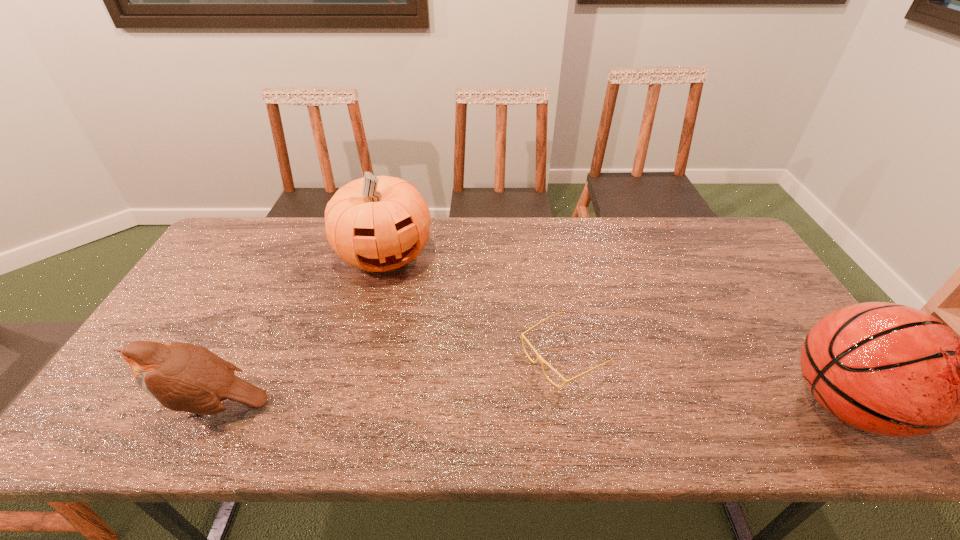
Where is `the leftmost object`? This screenshot has height=540, width=960. the leftmost object is located at coordinates (185, 377).

The height and width of the screenshot is (540, 960). Find the location of `bird`. bird is located at coordinates (185, 377).

This screenshot has height=540, width=960. Identify the location of basketball. (888, 369).

The height and width of the screenshot is (540, 960). In order to click on the shortest object in this screenshot , I will do `click(539, 357)`.

Locate an element on the screen. This screenshot has height=540, width=960. the second object from right to left is located at coordinates [x=539, y=357].

At what (x,y) coordinates should I click in order to perform the action: click on the third object from right to left. Please return your answer as a coordinate pair (x, y). Image resolution: width=960 pixels, height=540 pixels. Looking at the image, I should click on (377, 223).

You are a GUI agent. You are given a task and a screenshot of the screen. Output one action in this format:
    pyautogui.click(x=<x>, y=<y>)
    Task: Click on the farthest object
    Image resolution: width=960 pixels, height=540 pixels.
    Given the screenshot: What is the action you would take?
    pyautogui.click(x=377, y=223)

This screenshot has width=960, height=540. Find the location of `free space located at the face of the leftmost object`. free space located at the face of the leftmost object is located at coordinates (104, 405).

The image size is (960, 540). I want to click on vacant space situated at the face of the leftmost object, so click(x=112, y=405).

Image resolution: width=960 pixels, height=540 pixels. I want to click on vacant space positioned at the face of the leftmost object, so click(x=104, y=405).